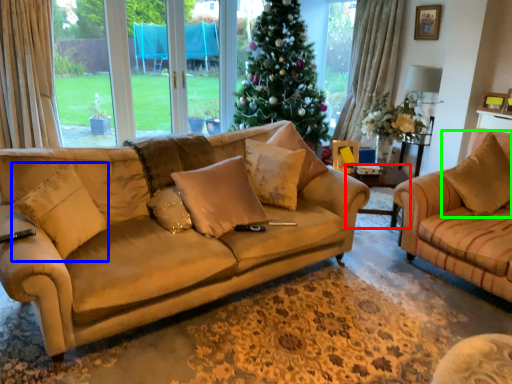
Question: Estimate the real-world distances between objects in this image. Which object is closer to side table (highlighted by a red box), pillow (highlighted by a blue box) or pillow (highlighted by a green box)?

Choices:
 (A) pillow
 (B) pillow

Answer: (B)